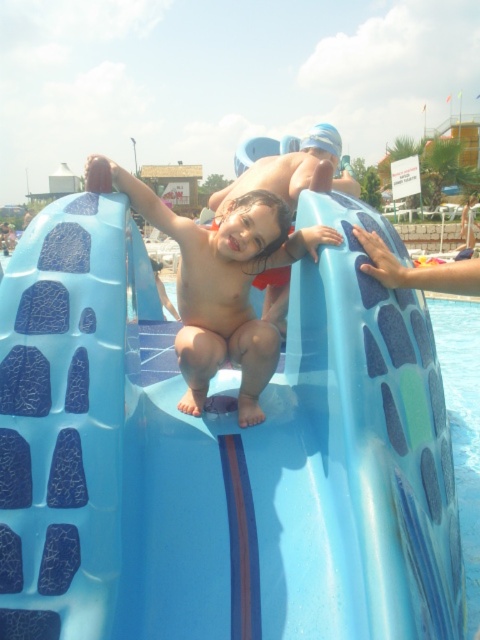
You are a parent at the water park and want to ensure your child can safely climb the blue rubber slide at center and the matte blue slide at center. Which slide requires a higher climbing effort due to its height?

The blue rubber slide at center requires more climbing effort because it has a greater height compared to the matte blue slide at center.

You are a parent at the water park. Your child is sitting on the blue rubber slide at center and wants to jump into the blue glossy water at lower right. Can they reach the water safely without hitting any obstacles?

The blue rubber slide at center and blue glossy water at lower right are 2.32 meters apart from each other. Since the distance is sufficient, the child can safely jump into the water without hitting any obstacles.

You are standing at the center of the water park and see the point marked at coordinates (218, 452). What object is located at that point?

The point marked at coordinates (218, 452) marks the blue rubber slide at center.